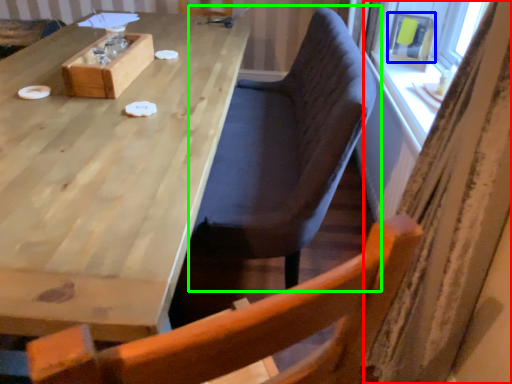
Question: Considering the real-world distances, which object is farthest from curtain (highlighted by a red box)? window screen (highlighted by a blue box) or chair (highlighted by a green box)?

Choices:
 (A) window screen
 (B) chair

Answer: (A)